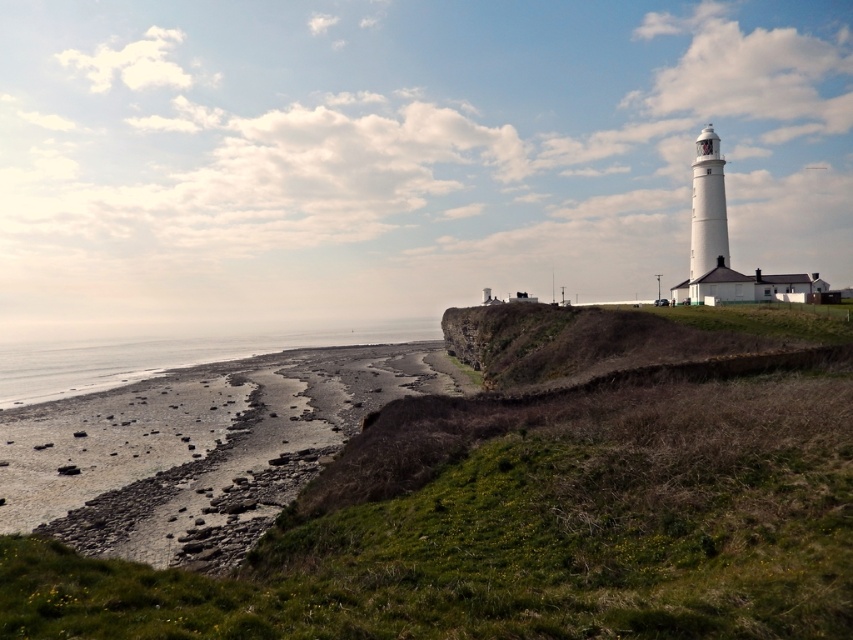
In the scene shown: You are standing at the base of the white lighthouse and want to reach the gray sand at lower left without stepping on the smooth pebbles at lower left. What should you do?

Since the smooth pebbles at lower left are 78.04 meters away from the gray sand at lower left, you can walk around the smooth pebbles at lower left to reach the gray sand at lower left safely.

You are standing on the rocky shoreline and want to pick up the smooth pebbles at lower left. According to the coordinates provided, where exactly should you look to find them?

The smooth pebbles at lower left are located at point 0.703 on the x axis and 0.233 on the y axis.

You are standing on the beach and want to pick up the smooth pebbles at lower left and gray sand at lower left. Which one would you need to use a smaller container to collect?

The smooth pebbles at lower left has a smaller size compared to gray sand at lower left, so you need a smaller container to collect the smooth pebbles at lower left.